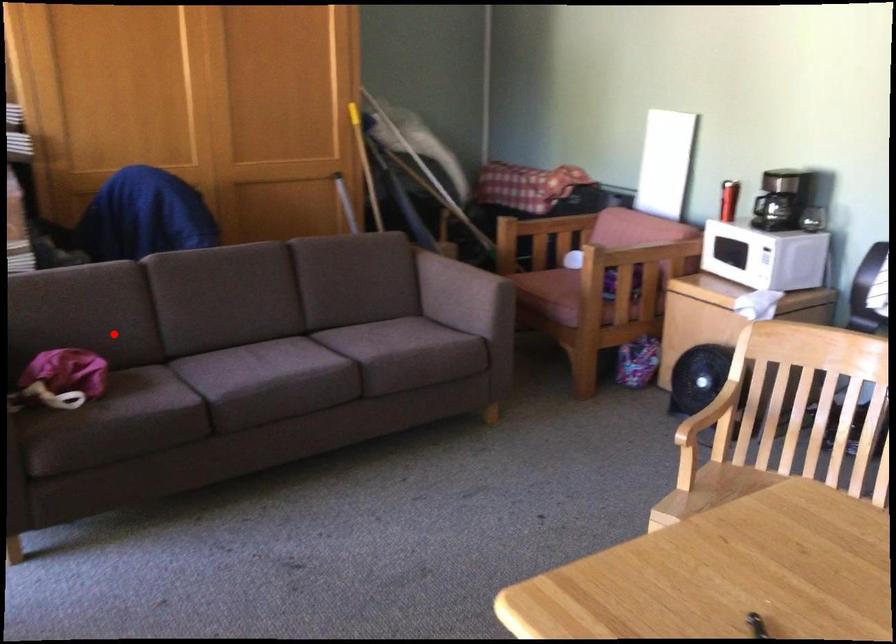
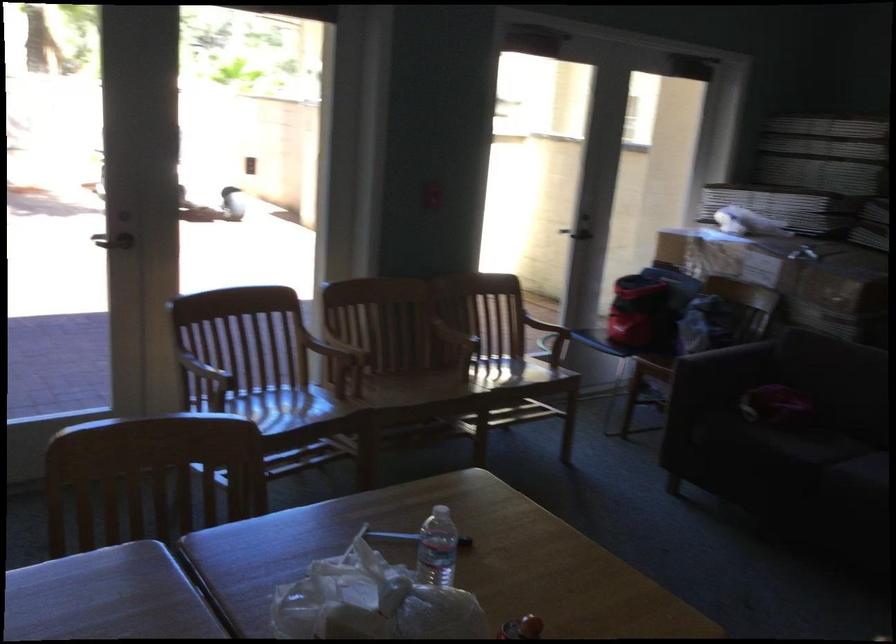
The point at the highlighted location is marked in the first image. Where is the corresponding point in the second image?

(843, 392)